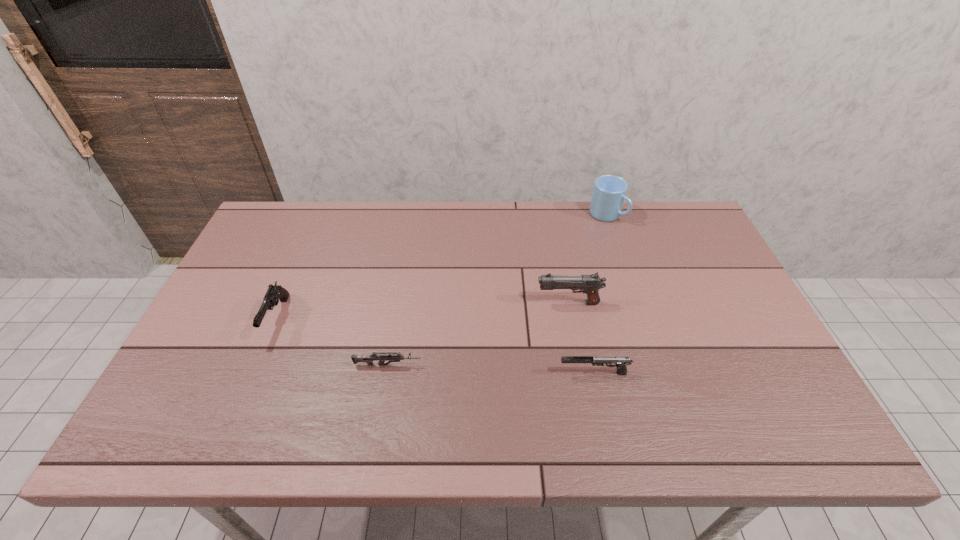
Identify the location of free space that is in between the tallest gun and the mug. (588, 259).

Image resolution: width=960 pixels, height=540 pixels. In order to click on free space between the farthest object and the leftmost object in this screenshot , I will do `click(442, 266)`.

At what (x,y) coordinates should I click in order to perform the action: click on free area in between the third farthest gun and the mug. Please return your answer as a coordinate pair (x, y). Image resolution: width=960 pixels, height=540 pixels. Looking at the image, I should click on (497, 290).

The image size is (960, 540). I want to click on unoccupied position between the farthest object and the nearest object, so [x=600, y=294].

Find the location of a particular element. This screenshot has width=960, height=540. object identified as the second closest to the third tallest gun is located at coordinates [368, 359].

This screenshot has height=540, width=960. Identify the location of the second closest object relative to the second shortest gun. (368, 359).

You are a GUI agent. You are given a task and a screenshot of the screen. Output one action in this format:
    pyautogui.click(x=<x>, y=<y>)
    Task: Click on the second closest gun to the nearest gun
    The image size is (960, 540).
    Given the screenshot: What is the action you would take?
    pyautogui.click(x=368, y=359)

Where is `gun that is the second closest one to the tallest gun`? The height and width of the screenshot is (540, 960). gun that is the second closest one to the tallest gun is located at coordinates (368, 359).

Where is `free space that satisfies the following two spatial constraints: 1. on the front side of the rightmost object; 2. aimed along the barrel of the second object from left to right`? free space that satisfies the following two spatial constraints: 1. on the front side of the rightmost object; 2. aimed along the barrel of the second object from left to right is located at coordinates (657, 365).

Find the location of a particular element. free space that satisfies the following two spatial constraints: 1. on the front side of the mug; 2. aimed along the barrel of the shortest object is located at coordinates (657, 365).